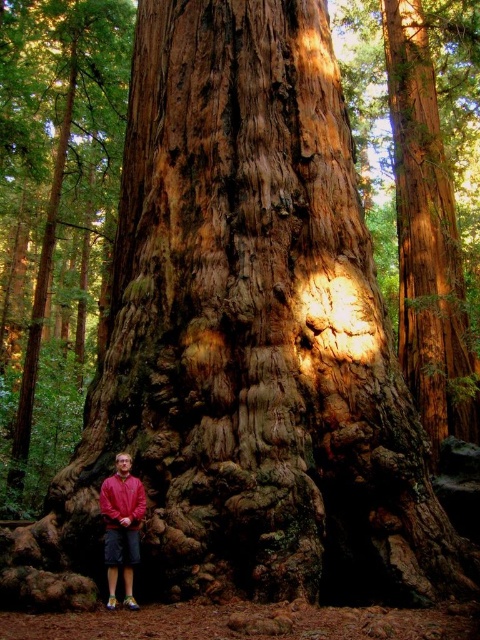
You are standing in front of the massive redwood tree and want to take a photo. You notice two points marked in the scene. The first point is at coordinates point (3, 300), and the second is at point (137, 477). Which point is closer to your camera lens?

Point (3, 300) is further to the camera than point (137, 477), so the second point is closer to the camera lens.

You are a hiker who wants to take a photo of the rough bark tree at lower left and the red matte sweatshirt at lower left. Your camera can focus on objects within 10 meters. Can you capture both in a single focused shot?

The rough bark tree at lower left is 10.13 meters away from the red matte sweatshirt at lower left. Since the camera can only focus within 10 meters, the distance between them exceeds the focus range, so you cannot capture both in a single focused shot.